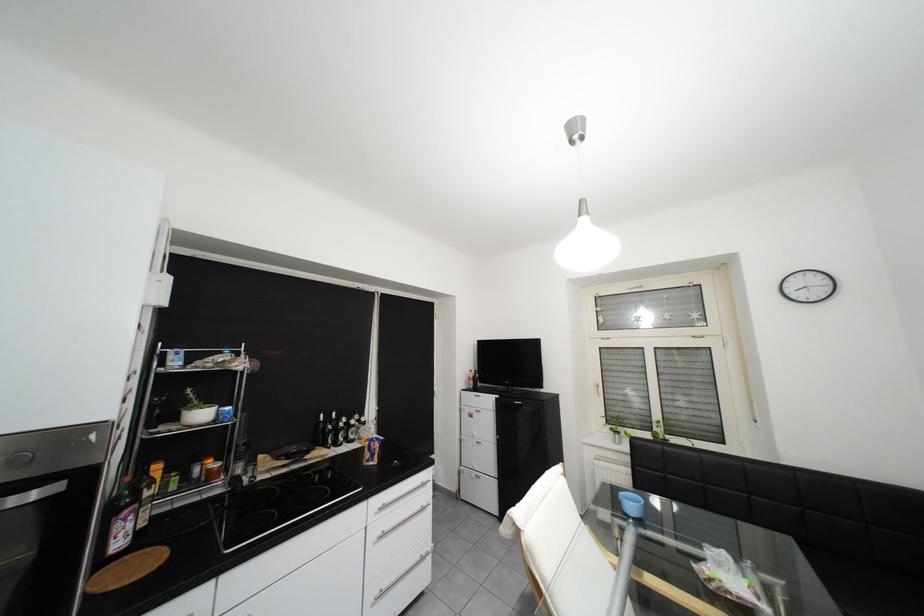
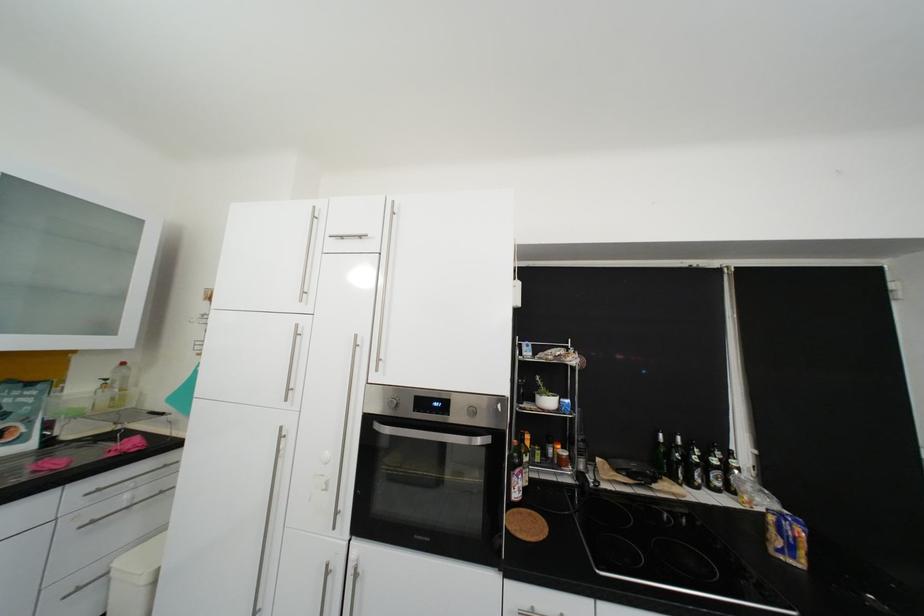
The point at (353, 446) is marked in the first image. Where is the corresponding point in the second image?

(710, 488)